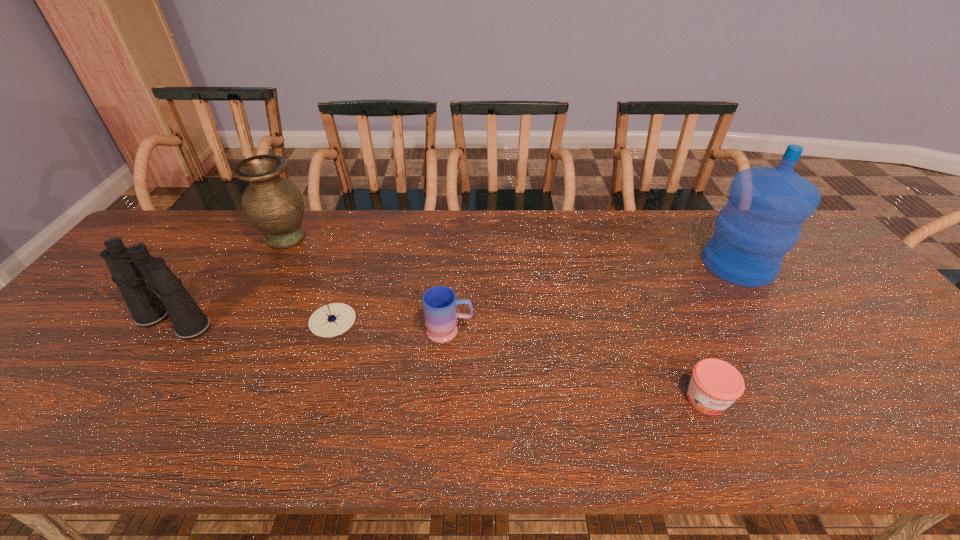
The image size is (960, 540). Identify the location of blank space located 0.070m on the back of the rightmost object. (715, 231).

At what (x,y) coordinates should I click in order to perform the action: click on free point located 0.110m on the right of the vase. Please return your answer as a coordinate pair (x, y). The height and width of the screenshot is (540, 960). Looking at the image, I should click on (347, 238).

I want to click on vacant region located 0.340m on the back of the binoculars, so click(x=237, y=231).

This screenshot has height=540, width=960. I want to click on free space located 0.250m on the side of the fourth object from left to right with the handle, so click(572, 331).

The image size is (960, 540). In order to click on free space located on the back of the compass in this screenshot , I will do `click(349, 270)`.

This screenshot has width=960, height=540. Identify the location of water jug situated at the far edge. (767, 206).

The height and width of the screenshot is (540, 960). In order to click on vase located in the far edge section of the desktop in this screenshot , I will do `click(274, 205)`.

Identify the location of object located at the near edge. (715, 384).

In order to click on free space at the far edge of the desktop in this screenshot , I will do `click(617, 231)`.

In the image, there is a desktop. Find the location of `blank space at the near edge`. blank space at the near edge is located at coordinates (775, 422).